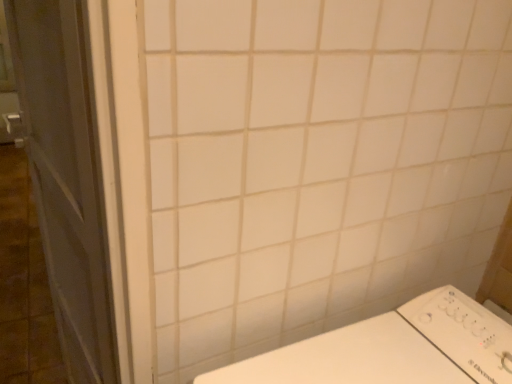
Identify the location of matte gray screen door at left. 66,176.

Describe the element at coordinates (66, 176) in the screenshot. This screenshot has width=512, height=384. I see `matte gray screen door at left` at that location.

Where is `matte gray screen door at left`? The image size is (512, 384). matte gray screen door at left is located at coordinates (66, 176).